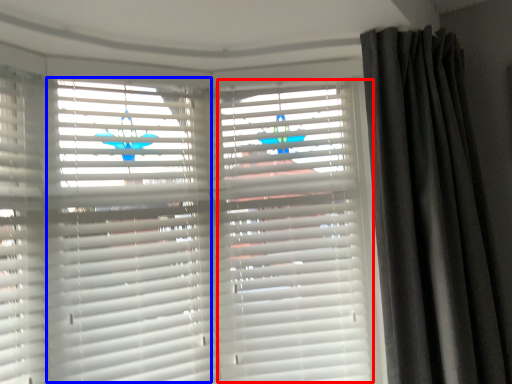
Question: Which of the following is the farthest to the observer, shutter (highlighted by a red box) or shutter (highlighted by a blue box)?

Choices:
 (A) shutter
 (B) shutter

Answer: (A)